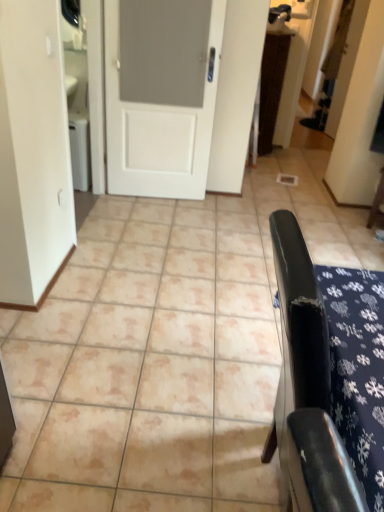
Where is `blank space to the left of wooden chair at right, the second furniture in the front-to-back sequence`? This screenshot has height=512, width=384. blank space to the left of wooden chair at right, the second furniture in the front-to-back sequence is located at coordinates (347, 218).